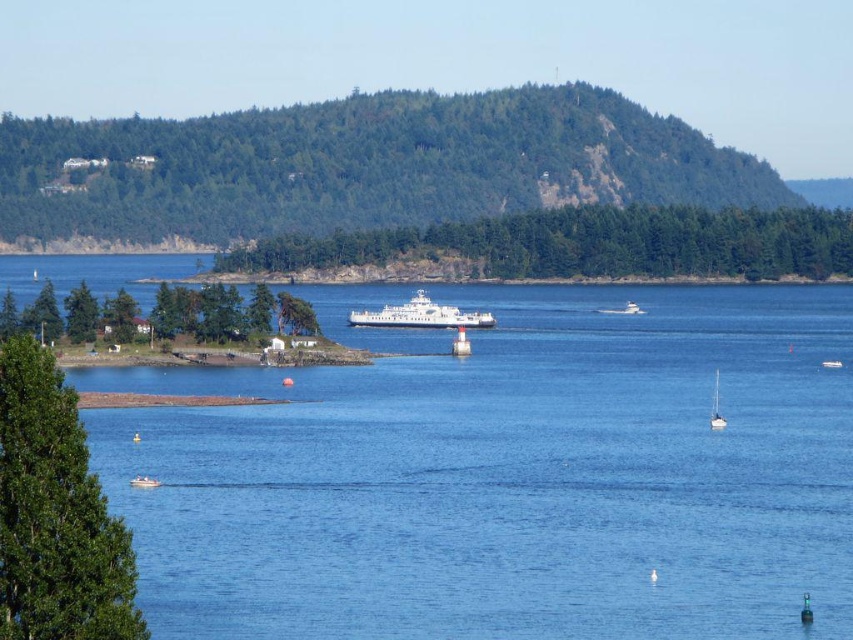
Between point (160, 483) and point (838, 364), which one is positioned behind?

The point (838, 364) is behind.

Is point (141, 476) behind point (821, 365)?

No, it is not.

At what (x,y) coordinates should I click in order to perform the action: click on white plastic boat at lower left. Please return your answer as a coordinate pair (x, y). Looking at the image, I should click on (144, 481).

Is blue water at center thinner than white glossy sailboat at lower right?

No.

Based on the photo, can you confirm if blue water at center is wider than white glossy sailboat at lower right?

Yes, blue water at center is wider than white glossy sailboat at lower right.

Between point (643, 452) and point (714, 380), which one is positioned in front?

Positioned in front is point (643, 452).

Find the location of `blue water at center`. blue water at center is located at coordinates (506, 476).

Who is more forward, (477, 324) or (833, 364)?

Point (833, 364) is in front.

Is white glossy ferry at center positioned before white matte boat at center?

No, white glossy ferry at center is behind white matte boat at center.

Is point (442, 316) positioned in front of point (822, 362)?

No.

This screenshot has width=853, height=640. Find the location of `white glossy ferry at center`. white glossy ferry at center is located at coordinates (421, 316).